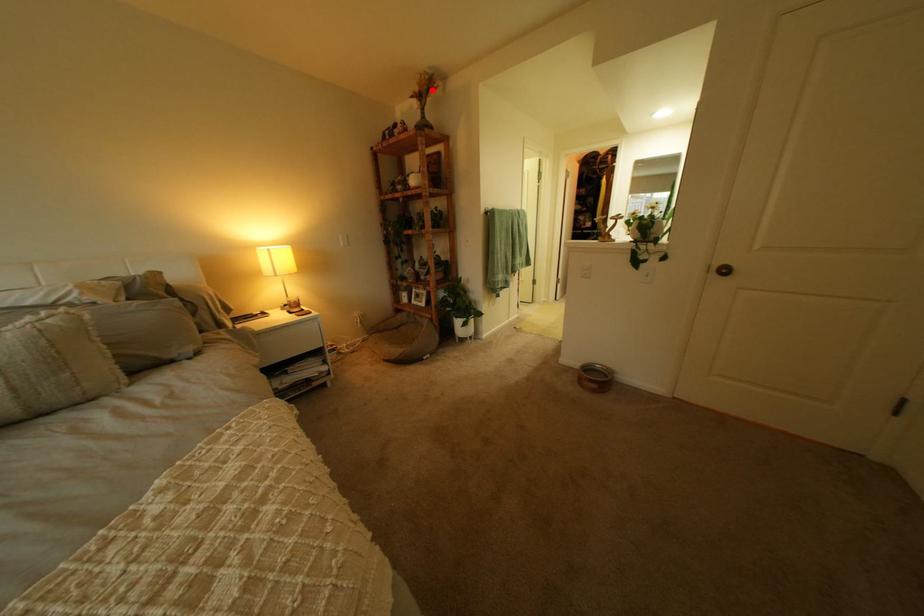
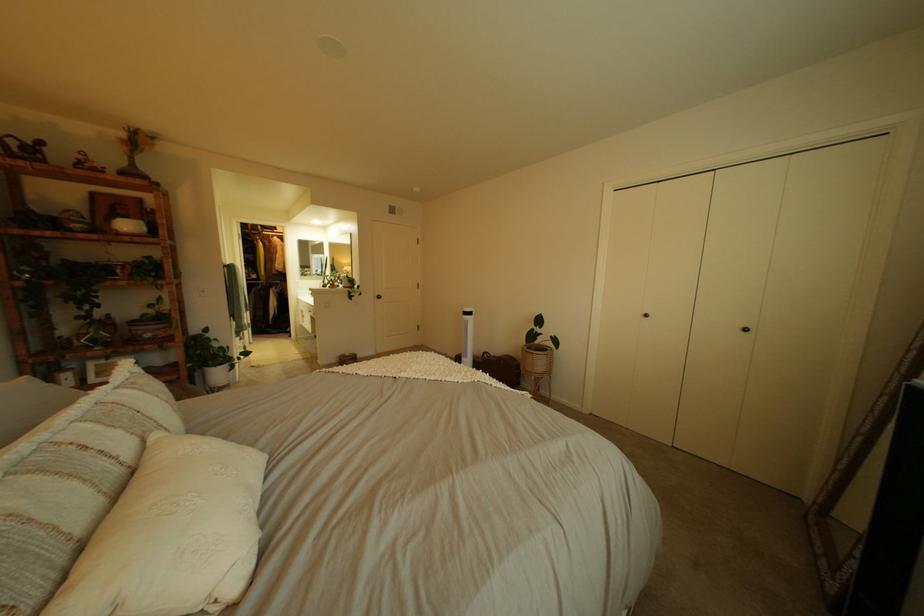
The point at the highlighted location is marked in the first image. Where is the corresponding point in the second image?

(139, 137)